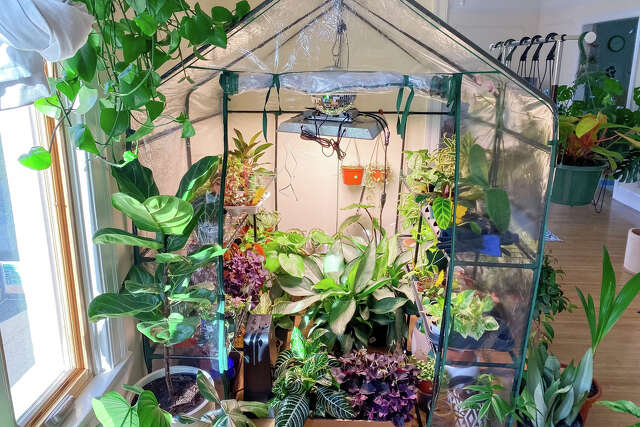
Locate an element on the screen. window is located at coordinates (15, 273).